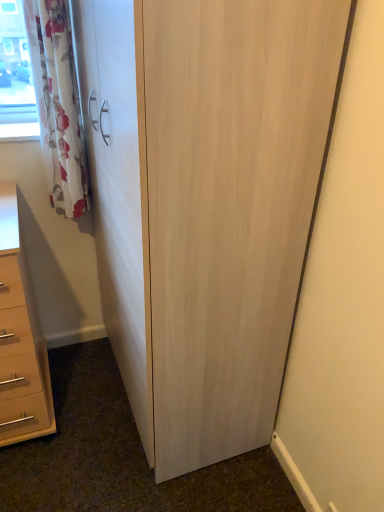
This screenshot has height=512, width=384. What are the coordinates of `free point to the right of matte beige chest of drawers at lower left` in the screenshot? It's located at (90, 410).